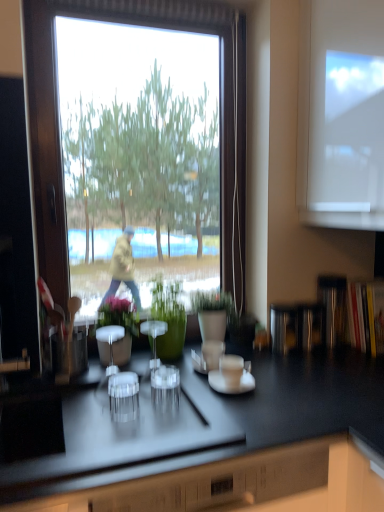
Question: In the image, is clear glass salt shaker at center positioned in front of or behind green matte plant at center, which is counted as the 1th houseplant, starting from the right?

Choices:
 (A) behind
 (B) front

Answer: (B)

Question: From a real-world perspective, is clear glass salt shaker at center physically located above or below green matte plant at center, which is counted as the 1th houseplant, starting from the right?

Choices:
 (A) below
 (B) above

Answer: (A)

Question: Which of these objects is positioned farthest from the green matte plant at center, which is counted as the 1th houseplant, starting from the right?

Choices:
 (A) white glossy saucer at center
 (B) green glossy vase at center, acting as the third houseplant starting from the right
 (C) green matte vase at center, placed as the 2th houseplant when sorted from right to left
 (D) clear glass salt shaker at center
 (E) shiny black countertop at center

Answer: (E)

Question: Estimate the real-world distances between objects in this image. Which object is closer to the green glossy vase at center, acting as the third houseplant starting from the right?

Choices:
 (A) shiny black countertop at center
 (B) transparent plastic shot glass at center
 (C) clear glass salt shaker at center
 (D) green matte vase at center, placed as the 2th houseplant when sorted from right to left
 (E) green matte plant at center, arranged as the 3th houseplant when viewed from the left

Answer: (C)